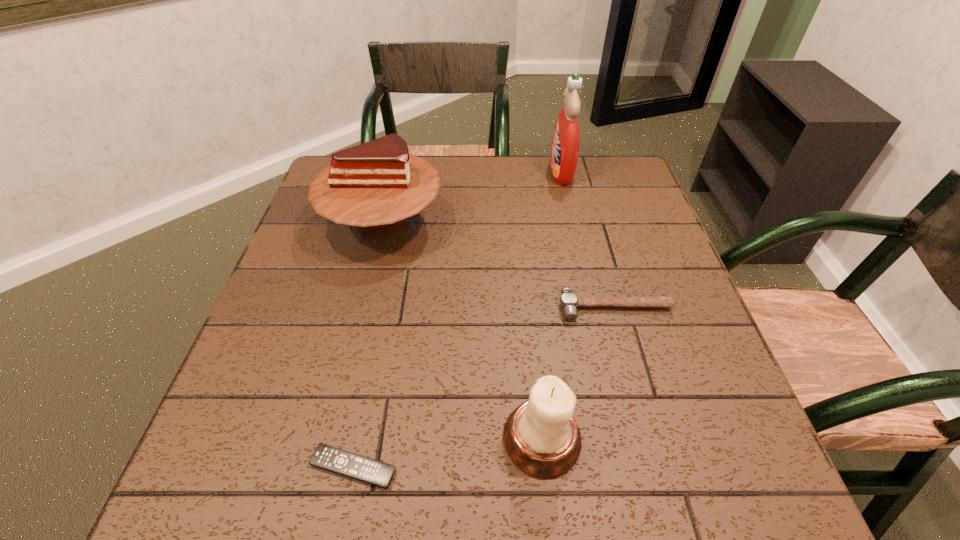
Find the location of a particular element. object positioned at the left edge is located at coordinates (375, 186).

Find the location of a particular element. object that is at the right edge is located at coordinates (568, 301).

Locate an element on the screen. This screenshot has width=960, height=540. object that is at the far left corner is located at coordinates (375, 186).

Identify the location of free space at the far edge of the desktop. (479, 168).

Where is `vacant area at the near edge`? vacant area at the near edge is located at coordinates (479, 496).

Identify the location of vacant space at the left edge. (303, 344).

Identify the location of free space at the right edge. (731, 428).

I want to click on vacant space at the far right corner of the desktop, so click(627, 198).

Locate an element on the screen. The image size is (960, 540). empty space between the third tallest object and the second shortest object is located at coordinates (578, 373).

I want to click on unoccupied area between the shortest object and the second farthest object, so click(x=368, y=346).